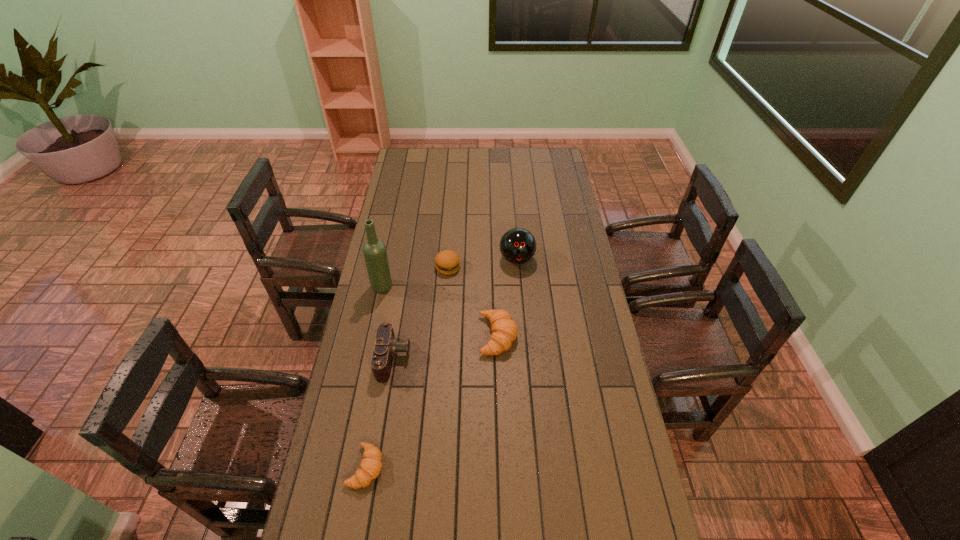
Locate an element on the screen. The image size is (960, 540). vacant spot to place a crescent roll on the right is located at coordinates (586, 249).